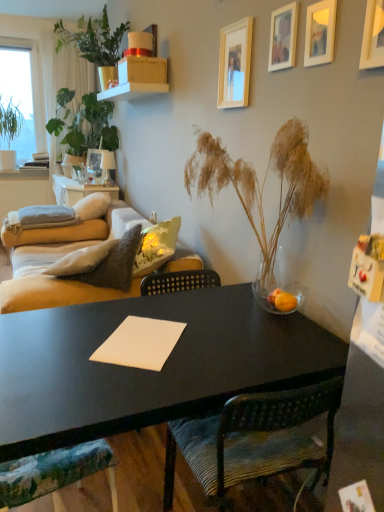
Question: Is white soft pillow at left, placed as the first pillow when sorted from right to left, beside wooden textured chair at lower left, placed as the second chair when sorted from right to left?

Choices:
 (A) yes
 (B) no

Answer: (B)

Question: Can wooden textured chair at lower left, the first chair positioned from the left, be found inside white soft pillow at left, placed as the first pillow when sorted from right to left?

Choices:
 (A) no
 (B) yes

Answer: (A)

Question: Is the depth of white soft pillow at left, marked as the 2th pillow in a left-to-right arrangement, greater than that of wooden textured chair at lower left, the first chair positioned from the left?

Choices:
 (A) yes
 (B) no

Answer: (A)

Question: Considering the relative sizes of white soft pillow at left, marked as the 2th pillow in a left-to-right arrangement, and wooden textured chair at lower left, the first chair positioned from the left, in the image provided, is white soft pillow at left, marked as the 2th pillow in a left-to-right arrangement, thinner than wooden textured chair at lower left, the first chair positioned from the left,?

Choices:
 (A) yes
 (B) no

Answer: (B)

Question: Considering the relative sizes of white soft pillow at left, marked as the 2th pillow in a left-to-right arrangement, and wooden textured chair at lower left, the first chair positioned from the left, in the image provided, is white soft pillow at left, marked as the 2th pillow in a left-to-right arrangement, bigger than wooden textured chair at lower left, the first chair positioned from the left,?

Choices:
 (A) yes
 (B) no

Answer: (A)

Question: From the image's perspective, is white soft pillow at left, placed as the first pillow when sorted from right to left, beneath wooden textured chair at lower left, the first chair positioned from the left?

Choices:
 (A) yes
 (B) no

Answer: (B)

Question: Is green leafy plant at upper left, placed as the 3th houseplant when sorted from left to right, outside of matte beige sofa at left?

Choices:
 (A) yes
 (B) no

Answer: (A)

Question: From the image's perspective, is green leafy plant at upper left, the 3th houseplant viewed from the back, above matte beige sofa at left?

Choices:
 (A) yes
 (B) no

Answer: (A)

Question: Is green leafy plant at upper left, positioned as the second houseplant in front-to-back order, bigger than matte beige sofa at left?

Choices:
 (A) no
 (B) yes

Answer: (B)

Question: Is green leafy plant at upper left, the 3th houseplant viewed from the back, facing away from matte beige sofa at left?

Choices:
 (A) no
 (B) yes

Answer: (A)

Question: Does green leafy plant at upper left, which is the second houseplant in right-to-left order, appear on the left side of matte beige sofa at left?

Choices:
 (A) no
 (B) yes

Answer: (A)

Question: Is green leafy plant at upper left, the 3th houseplant viewed from the back, taller than matte beige sofa at left?

Choices:
 (A) yes
 (B) no

Answer: (A)

Question: From a real-world perspective, is matte cardboard box at upper center on gray fabric pillow at left, the second pillow viewed from the right?

Choices:
 (A) no
 (B) yes

Answer: (B)